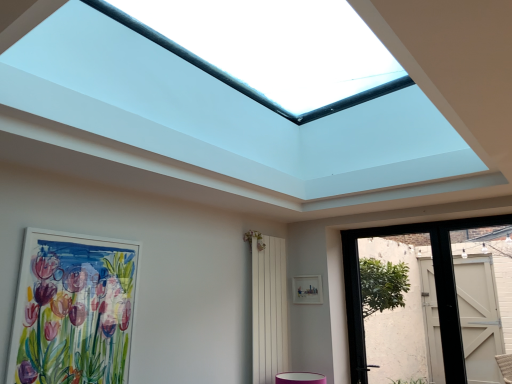
What do you see at coordinates (359, 277) in the screenshot? The image size is (512, 384). I see `matte black door at right, the 2th door viewed from the right` at bounding box center [359, 277].

This screenshot has width=512, height=384. In order to click on white wooden screen door at center in this screenshot , I will do `click(269, 310)`.

Locate an element on the screen. The width and height of the screenshot is (512, 384). white painted wood door at right, the first door positioned from the right is located at coordinates (479, 317).

Image resolution: width=512 pixels, height=384 pixels. What do you see at coordinates (256, 239) in the screenshot?
I see `pink fabric flower at center` at bounding box center [256, 239].

Locate an element on the screen. matte black door at right, the first door positioned from the left is located at coordinates (359, 277).

Consider the image. Does matte white picture frame at left, marked as the second picture frame in a right-to-left arrangement, come in front of white matte picture frame at center, placed as the second picture frame when sorted from left to right?

Yes, it is.

Is point (65, 383) closer to viewer compared to point (300, 276)?

Yes, it is in front of point (300, 276).

Can you tell me how much matte white picture frame at left, placed as the 1th picture frame when sorted from front to back, and white matte picture frame at center, placed as the second picture frame when sorted from left to right, differ in facing direction?

matte white picture frame at left, placed as the 1th picture frame when sorted from front to back, and white matte picture frame at center, placed as the second picture frame when sorted from left to right, are facing 91.1 degrees away from each other.

From the image's perspective, who appears lower, matte white picture frame at left, marked as the second picture frame in a right-to-left arrangement, or white matte picture frame at center, the second picture frame positioned from the front?

white matte picture frame at center, the second picture frame positioned from the front, from the image's perspective.

Considering the sizes of objects white matte picture frame at center, positioned as the 1th picture frame in right-to-left order, and matte white picture frame at left, placed as the 1th picture frame when sorted from front to back, in the image provided, who is wider, white matte picture frame at center, positioned as the 1th picture frame in right-to-left order, or matte white picture frame at left, placed as the 1th picture frame when sorted from front to back,?

Wider between the two is matte white picture frame at left, placed as the 1th picture frame when sorted from front to back.

Can you confirm if white matte picture frame at center, positioned as the 1th picture frame in right-to-left order, is taller than matte white picture frame at left, placed as the 1th picture frame when sorted from front to back?

No, white matte picture frame at center, positioned as the 1th picture frame in right-to-left order, is not taller than matte white picture frame at left, placed as the 1th picture frame when sorted from front to back.

The image size is (512, 384). In the image, there is a matte white picture frame at left, placed as the 1th picture frame when sorted from front to back. What are the coordinates of `picture frame below it (from the image's perspective)` in the screenshot? It's located at (307, 289).

Could matte white picture frame at left, acting as the 2th picture frame starting from the back, be considered to be inside white matte picture frame at center, placed as the second picture frame when sorted from left to right?

No.

Can you confirm if white wooden screen door at center is wider than matte white picture frame at left, marked as the second picture frame in a right-to-left arrangement?

Indeed, white wooden screen door at center has a greater width compared to matte white picture frame at left, marked as the second picture frame in a right-to-left arrangement.

Based on the photo, does white wooden screen door at center have a larger size compared to matte white picture frame at left, placed as the 1th picture frame when sorted from front to back?

Yes.

Considering their positions, is white wooden screen door at center located in front of or behind matte white picture frame at left, placed as the 1th picture frame when sorted from front to back?

Clearly, white wooden screen door at center is behind matte white picture frame at left, placed as the 1th picture frame when sorted from front to back.

Does white wooden screen door at center have a greater height compared to matte white picture frame at left, placed as the 1th picture frame when sorted from front to back?

Yes.

Which is correct: white painted wood door at right, which is counted as the second door, starting from the left, is inside white wooden screen door at center, or outside of it?

white painted wood door at right, which is counted as the second door, starting from the left, is spatially situated outside white wooden screen door at center.

Between white painted wood door at right, which is counted as the second door, starting from the left, and white wooden screen door at center, which one has larger width?

Wider between the two is white wooden screen door at center.

From a real-world perspective, between white painted wood door at right, which is counted as the second door, starting from the left, and white wooden screen door at center, who is vertically higher?

From a 3D spatial view, white painted wood door at right, which is counted as the second door, starting from the left, is above.

In terms of height, does white painted wood door at right, the first door positioned from the right, look taller or shorter compared to white wooden screen door at center?

Considering their sizes, white painted wood door at right, the first door positioned from the right, has less height than white wooden screen door at center.

Which is correct: white wooden screen door at center is inside pink fabric flower at center, or outside of it?

white wooden screen door at center is spatially situated outside pink fabric flower at center.

Does white wooden screen door at center turn towards pink fabric flower at center?

No, white wooden screen door at center is not facing towards pink fabric flower at center.

Considering the relative sizes of white wooden screen door at center and pink fabric flower at center in the image provided, is white wooden screen door at center taller than pink fabric flower at center?

Correct, white wooden screen door at center is much taller as pink fabric flower at center.

Considering the positions of point (267, 278) and point (248, 236), is point (267, 278) closer or farther from the camera than point (248, 236)?

Point (267, 278) is farther from the camera than point (248, 236).

Are matte white picture frame at left, acting as the 2th picture frame starting from the back, and pink fabric flower at center beside each other?

matte white picture frame at left, acting as the 2th picture frame starting from the back, is not next to pink fabric flower at center, and they're not touching.

Can you confirm if matte white picture frame at left, the 1th picture frame from the left, is taller than pink fabric flower at center?

Correct, matte white picture frame at left, the 1th picture frame from the left, is much taller as pink fabric flower at center.

Considering the positions of point (124, 276) and point (249, 231), is point (124, 276) closer or farther from the camera than point (249, 231)?

Point (124, 276) is closer to the camera than point (249, 231).

Is white painted wood door at right, which is counted as the second door, starting from the left, with white matte picture frame at center, the second picture frame positioned from the front?

white painted wood door at right, which is counted as the second door, starting from the left, and white matte picture frame at center, the second picture frame positioned from the front, are clearly separated.

Does white painted wood door at right, which is counted as the second door, starting from the left, have a greater width compared to white matte picture frame at center, the first picture frame viewed from the back?

Yes.

Considering the relative positions of white painted wood door at right, the first door positioned from the right, and white matte picture frame at center, the second picture frame positioned from the front, in the image provided, is white painted wood door at right, the first door positioned from the right, in front of white matte picture frame at center, the second picture frame positioned from the front,?

Yes, the depth of white painted wood door at right, the first door positioned from the right, is less than that of white matte picture frame at center, the second picture frame positioned from the front.

Where is `picture frame positioned vertically above the matte white picture frame at left, placed as the 1th picture frame when sorted from front to back (from a real-world perspective)`? The width and height of the screenshot is (512, 384). picture frame positioned vertically above the matte white picture frame at left, placed as the 1th picture frame when sorted from front to back (from a real-world perspective) is located at coordinates (307, 289).

Where is `picture frame above the white matte picture frame at center, placed as the second picture frame when sorted from left to right (from the image's perspective)`? This screenshot has height=384, width=512. picture frame above the white matte picture frame at center, placed as the second picture frame when sorted from left to right (from the image's perspective) is located at coordinates (73, 310).

From the image, which object appears to be farther from matte black door at right, the 2th door viewed from the right, pink fabric flower at center or white painted wood door at right, the first door positioned from the right?

pink fabric flower at center is positioned further to the anchor matte black door at right, the 2th door viewed from the right.

Estimate the real-world distances between objects in this image. Which object is further from white matte picture frame at center, placed as the second picture frame when sorted from left to right, matte black door at right, the 2th door viewed from the right, or matte white picture frame at left, the 1th picture frame from the left?

matte white picture frame at left, the 1th picture frame from the left.

When comparing their distances from matte white picture frame at left, the 1th picture frame from the left, does white wooden screen door at center or pink fabric flower at center seem further?

Among the two, pink fabric flower at center is located further to matte white picture frame at left, the 1th picture frame from the left.

Estimate the real-world distances between objects in this image. Which object is further from white matte picture frame at center, positioned as the 1th picture frame in right-to-left order, white wooden screen door at center or matte white picture frame at left, the 1th picture frame from the left?

matte white picture frame at left, the 1th picture frame from the left, is positioned further to the anchor white matte picture frame at center, positioned as the 1th picture frame in right-to-left order.

Which object lies nearer to the anchor point white wooden screen door at center, matte black door at right, the 2th door viewed from the right, or pink fabric flower at center?

Based on the image, pink fabric flower at center appears to be nearer to white wooden screen door at center.

Estimate the real-world distances between objects in this image. Which object is closer to white painted wood door at right, the first door positioned from the right, white matte picture frame at center, the first picture frame viewed from the back, or matte black door at right, the first door positioned from the left?

matte black door at right, the first door positioned from the left, is positioned closer to the anchor white painted wood door at right, the first door positioned from the right.

Consider the image. Estimate the real-world distances between objects in this image. Which object is closer to matte black door at right, the 2th door viewed from the right, white matte picture frame at center, positioned as the 1th picture frame in right-to-left order, or pink fabric flower at center?

Based on the image, white matte picture frame at center, positioned as the 1th picture frame in right-to-left order, appears to be nearer to matte black door at right, the 2th door viewed from the right.

From the image, which object appears to be farther from matte white picture frame at left, placed as the 1th picture frame when sorted from front to back, matte black door at right, the first door positioned from the left, or white painted wood door at right, the first door positioned from the right?

Based on the image, white painted wood door at right, the first door positioned from the right, appears to be further to matte white picture frame at left, placed as the 1th picture frame when sorted from front to back.

Locate an element on the screen. The image size is (512, 384). screen door situated between matte white picture frame at left, marked as the second picture frame in a right-to-left arrangement, and white painted wood door at right, which is counted as the second door, starting from the left, from left to right is located at coordinates (269, 310).

Where is `picture frame between white wooden screen door at center and matte black door at right, the 2th door viewed from the right, in the horizontal direction`? Image resolution: width=512 pixels, height=384 pixels. picture frame between white wooden screen door at center and matte black door at right, the 2th door viewed from the right, in the horizontal direction is located at coordinates (307, 289).

You are a GUI agent. You are given a task and a screenshot of the screen. Output one action in this format:
    pyautogui.click(x=<x>, y=<y>)
    Task: Click on the screen door located between pink fabric flower at center and matte black door at right, the 2th door viewed from the right, in the left-right direction
    This screenshot has width=512, height=384.
    Given the screenshot: What is the action you would take?
    pyautogui.click(x=269, y=310)

Identify the location of door between white wooden screen door at center and white painted wood door at right, the first door positioned from the right, in the horizontal direction. (359, 277).